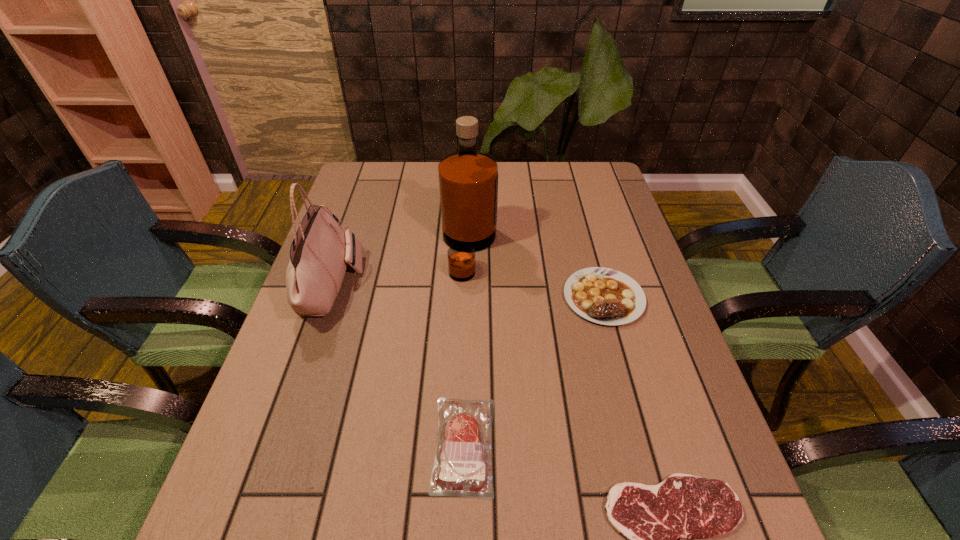
Identify the location of free space between the second tallest object and the tallest steak. This screenshot has width=960, height=540. (468, 291).

This screenshot has width=960, height=540. Find the location of `vacant area between the fourth shortest object and the liquor`. vacant area between the fourth shortest object and the liquor is located at coordinates (400, 267).

Locate an element on the screen. free space between the leftmost object and the leftmost steak is located at coordinates point(398,365).

What are the coordinates of `empty location between the tallest steak and the liquor` in the screenshot? It's located at (537, 273).

Identify the location of free space that is in between the leftmost object and the third tallest object. The image size is (960, 540). (468, 291).

Identify which object is the fourth nearest to the third shortest object. Please provide its 2D coordinates. Your answer should be formatted as a tuple, i.e. [(x, y)], where the tuple contains the x and y coordinates of a point satisfying the conditions above.

[(321, 249)]

Find the location of a particular element. The image size is (960, 540). object identified as the third closest to the shortest steak is located at coordinates (468, 180).

Identify which steak is located as the nearest to the handbag. Please provide its 2D coordinates. Your answer should be formatted as a tuple, i.e. [(x, y)], where the tuple contains the x and y coordinates of a point satisfying the conditions above.

[(460, 469)]

The height and width of the screenshot is (540, 960). I want to click on steak that stands as the second closest to the leftmost object, so click(605, 296).

Where is `vacant region that satisfies the following two spatial constraints: 1. on the side of the leftmost steak with the attached pouch; 2. on the right side of the second tallest object`? This screenshot has height=540, width=960. vacant region that satisfies the following two spatial constraints: 1. on the side of the leftmost steak with the attached pouch; 2. on the right side of the second tallest object is located at coordinates (277, 445).